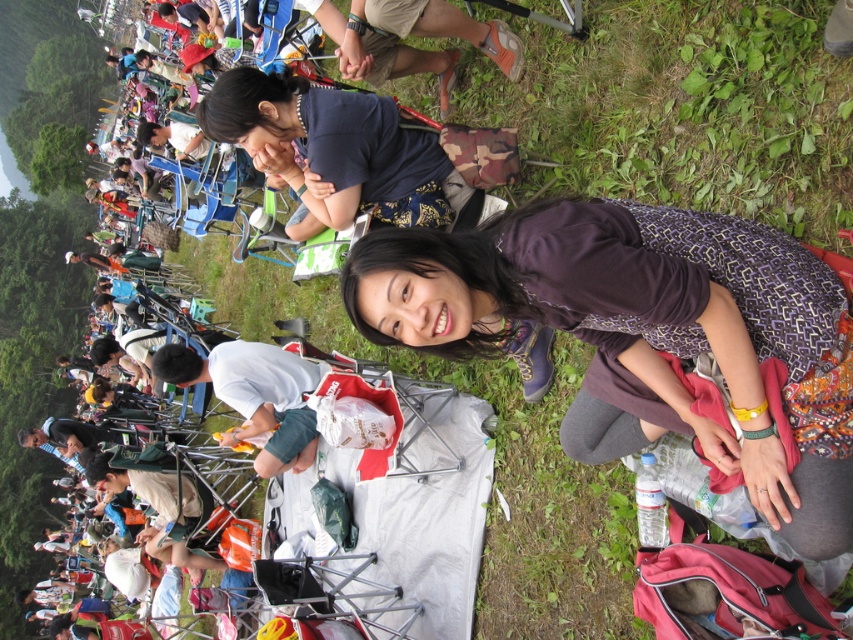
You are at a picnic and want to place a small basket between the dark blue fabric at center and the white cotton shirt at lower left. According to their positions, where should you place the basket?

The dark blue fabric at center is to the right of the white cotton shirt at lower left, so you should place the basket between them, closer to the white cotton shirt at lower left to maintain the spatial arrangement.

You are standing at the center of the picnic area and want to find the purple printed dress at center. Which direction should you look to locate it?

The purple printed dress at center is located at the coordinates point (x=645, y=333), which is slightly to the right and lower than the exact center of the scene.

Based on the photo, you are standing at the picnic area and see two points marked in the image. The first point is at coordinate point (262,90) and the second point is at coordinate point (158,353). Which point is closer to you?

Point (262,90) is in front of point (158,353), so it is closer to you.